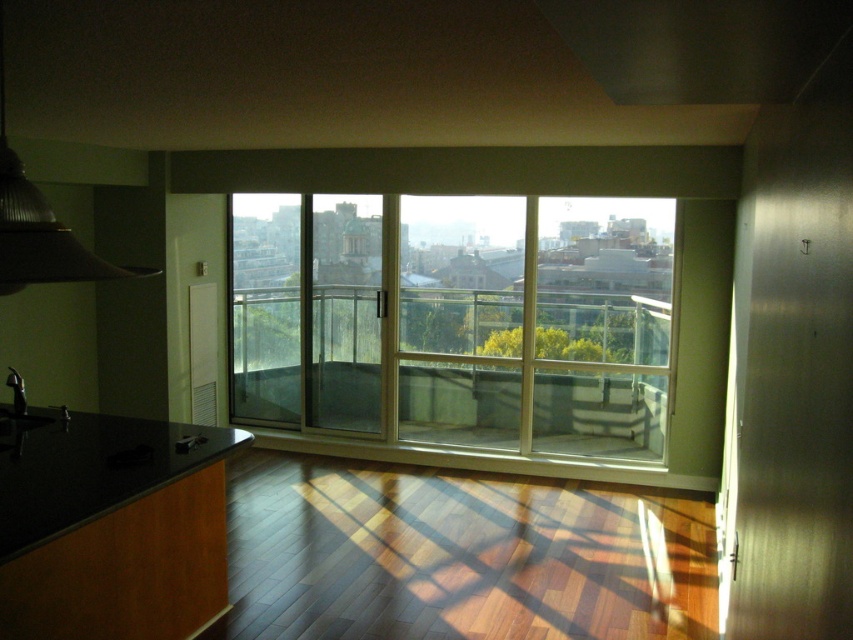
Question: Is clear glass window at center smaller than black granite countertop at lower left?

Choices:
 (A) yes
 (B) no

Answer: (B)

Question: Can you confirm if clear glass window at center is smaller than black granite countertop at lower left?

Choices:
 (A) yes
 (B) no

Answer: (B)

Question: Does clear glass window at center come in front of black granite countertop at lower left?

Choices:
 (A) yes
 (B) no

Answer: (B)

Question: Among these objects, which one is farthest from the camera?

Choices:
 (A) black granite countertop at lower left
 (B) clear glass window at center

Answer: (B)